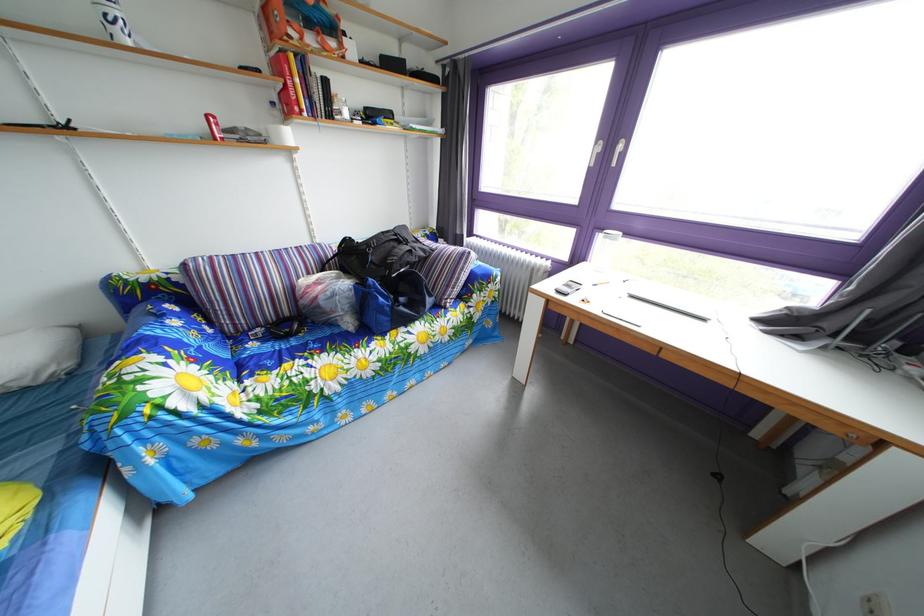
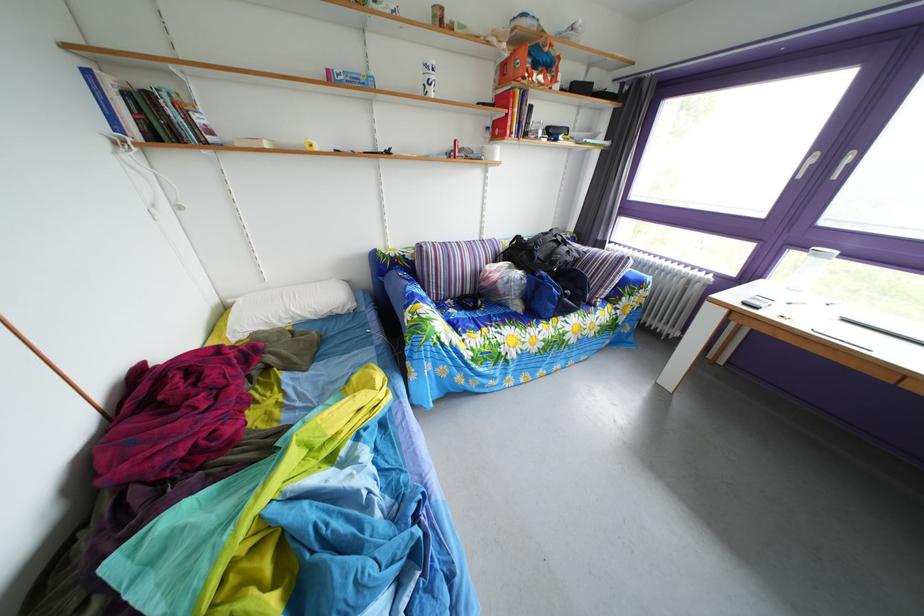
The point at (262, 353) is marked in the first image. Where is the corresponding point in the second image?

(463, 320)